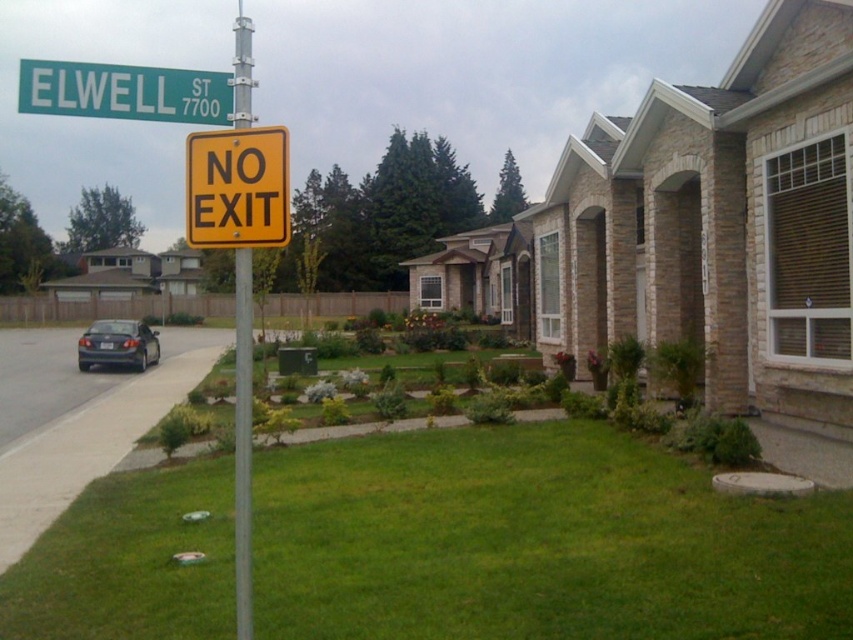
Is green plastic street sign at upper left thinner than metallic pole at center?

No.

Describe the element at coordinates (125, 92) in the screenshot. The width and height of the screenshot is (853, 640). I see `green plastic street sign at upper left` at that location.

Locate an element on the screen. green plastic street sign at upper left is located at coordinates [x=125, y=92].

Where is `green plastic street sign at upper left`? green plastic street sign at upper left is located at coordinates (125, 92).

Can you confirm if yellow matte/no exit sign at upper center is positioned above shiny dark gray sedan at left?

Correct, yellow matte/no exit sign at upper center is located above shiny dark gray sedan at left.

Is point (219, 189) farther from camera compared to point (117, 348)?

No, it is not.

Find the location of a particular element. The height and width of the screenshot is (640, 853). yellow matte/no exit sign at upper center is located at coordinates (236, 188).

Locate an element on the screen. The image size is (853, 640). yellow matte/no exit sign at upper center is located at coordinates (236, 188).

Does point (277, 209) come farther from viewer compared to point (236, 470)?

No, (277, 209) is closer to viewer.

Looking at this image, is yellow matte/no exit sign at upper center in front of metallic pole at center?

Yes, it is.

Does point (276, 168) come farther from viewer compared to point (242, 400)?

Yes, it is.

This screenshot has height=640, width=853. I want to click on yellow matte/no exit sign at upper center, so click(x=236, y=188).